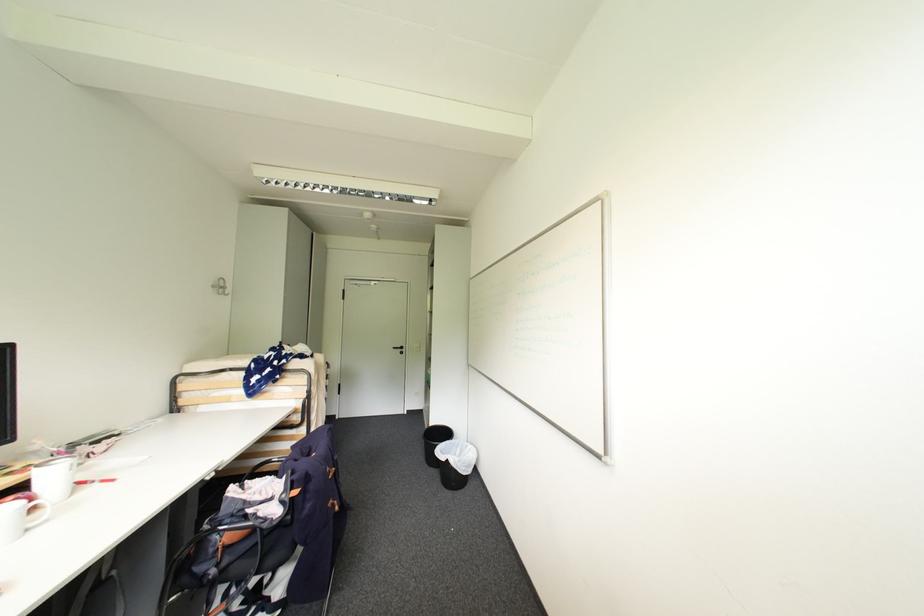
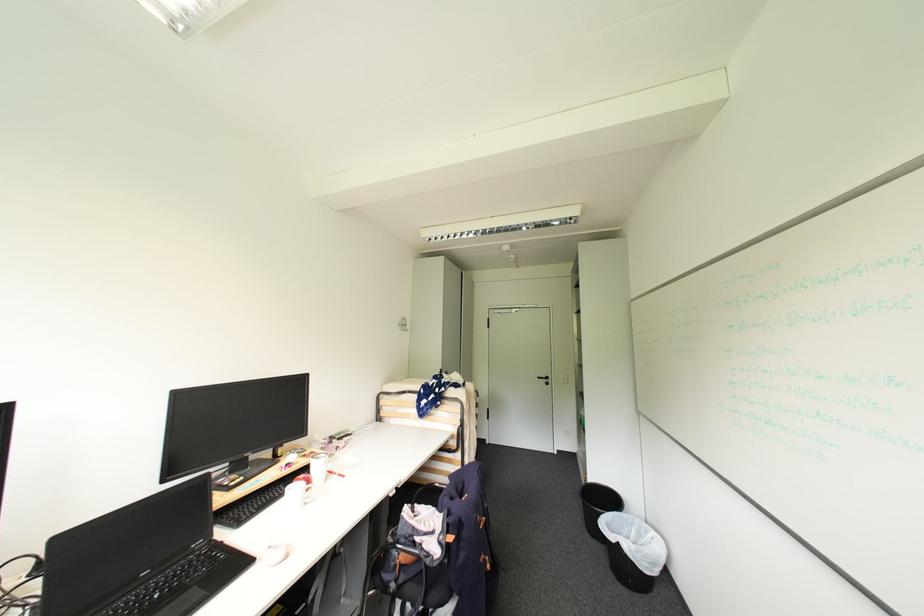
Locate, in the second image, the point that corresponds to (x=456, y=442) in the first image.

(624, 514)